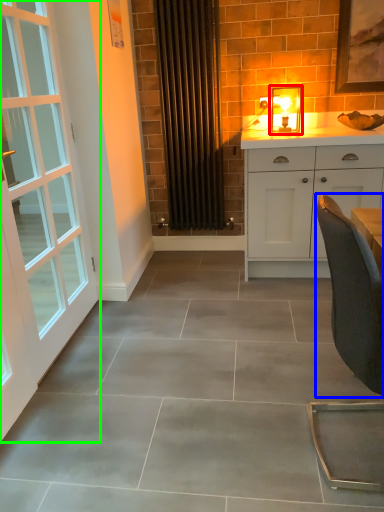
Question: Which object is positioned closest to light fixture (highlighted by a red box)? Select from chair (highlighted by a blue box) and door (highlighted by a green box).

Choices:
 (A) chair
 (B) door

Answer: (B)